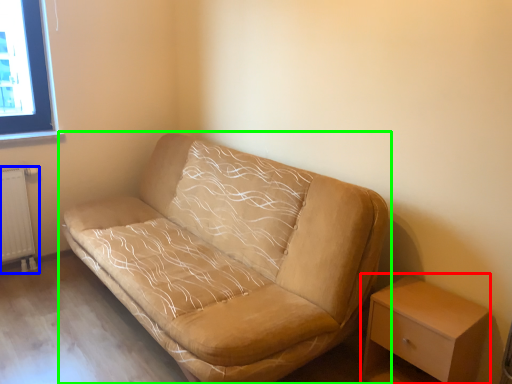
Question: Estimate the real-world distances between objects in this image. Which object is farther from table (highlighted by a red box), radiator (highlighted by a blue box) or studio couch (highlighted by a green box)?

Choices:
 (A) radiator
 (B) studio couch

Answer: (A)